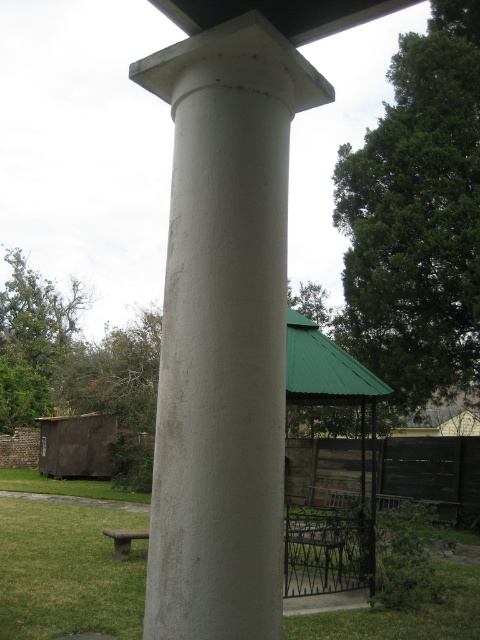
Which is in front, point (218, 45) or point (119, 547)?

Positioned in front is point (218, 45).

Is point (245, 516) less distant than point (132, 538)?

Yes, it is.

You are a GUI agent. You are given a task and a screenshot of the screen. Output one action in this format:
    pyautogui.click(x=<x>, y=<y>)
    Task: Click on the white smooth column at center
    The image size is (480, 640).
    Given the screenshot: What is the action you would take?
    pyautogui.click(x=225, y=314)

Between green grass at lower left and wooden picnic table at lower left, which one is positioned higher?

wooden picnic table at lower left is higher up.

Between green grass at lower left and wooden picnic table at lower left, which one is positioned lower?

Positioned lower is green grass at lower left.

This screenshot has width=480, height=640. What are the coordinates of `green grass at lower left` in the screenshot? It's located at (68, 572).

Between point (216, 282) and point (127, 584), which one is positioned behind?

Point (127, 584)

Find the location of `white smooth column at center`. white smooth column at center is located at coordinates (225, 314).